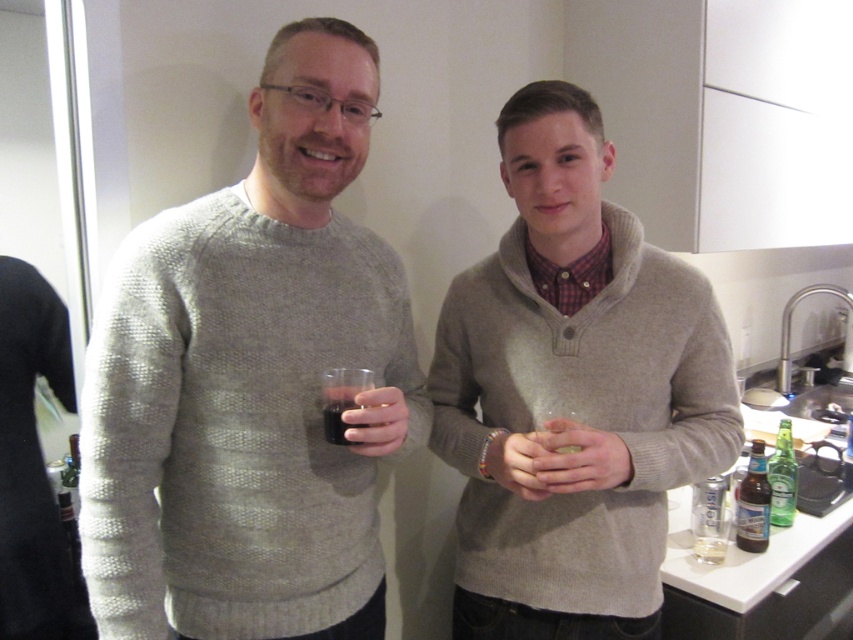
You are a guest in this kitchen and want to grab the green glass bottle at lower right without touching the clear glass at center. Can you reach it directly from your current position?

The clear glass at center is to the left of green glass bottle at lower right, so you can reach the green glass bottle at lower right directly without moving the clear glass at center since it is positioned to its right.

You are standing in a kitchen and see two people. The first person is on the left wearing a textured gray sweater and holding a glass with dark liquid. The second person is on the right wearing a gray sweater over a red plaid shirt and holding a glass with light liquid. There is a point at coordinates point (572,388). Which object does this point correspond to?

The point (572,388) corresponds to the matte gray sweater at center.

You are organizing a small party and need to place a 15 cm wide decorative item on the table. Given the knitted gray sweater at center and the matte plastic cup at center, which item can accommodate the decorative item without overlapping?

The knitted gray sweater at center has a larger width than the matte plastic cup at center, so the decorative item can be placed on the knitted gray sweater at center without overlapping.